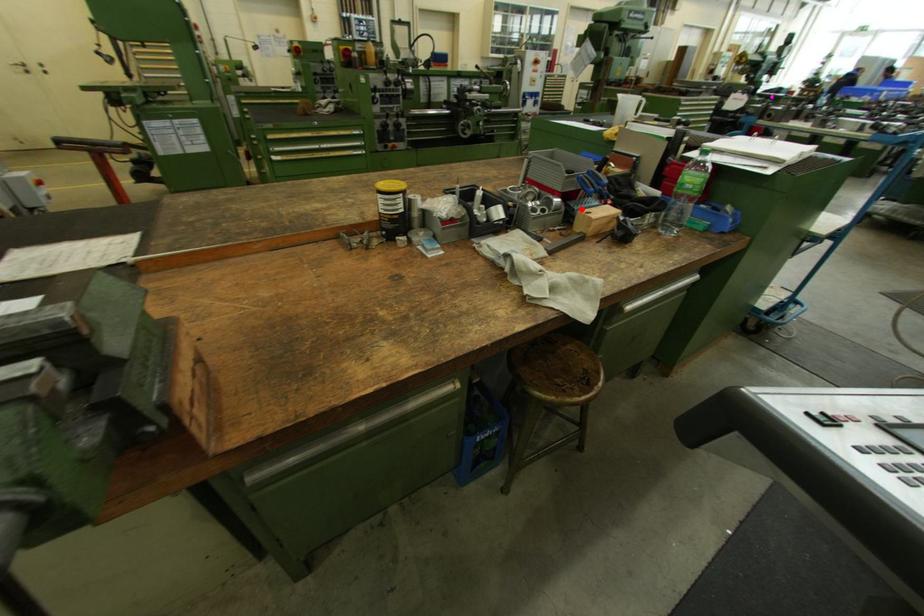
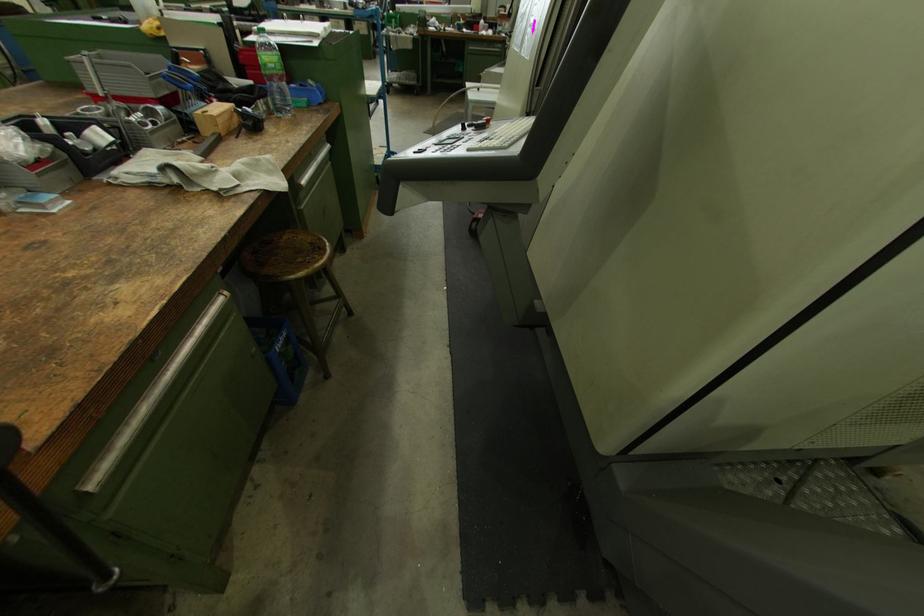
The point at the highlighted location is marked in the first image. Where is the corresponding point in the second image?

(192, 113)